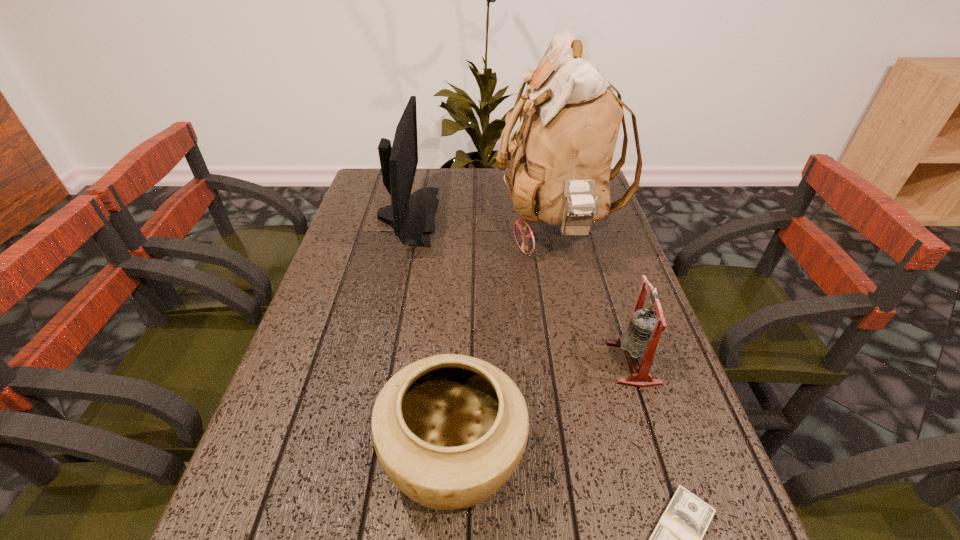
Locate an element on the screen. The width and height of the screenshot is (960, 540). free space located 0.320m on the right of the second shortest object is located at coordinates (710, 457).

Find the location of a particular element. This screenshot has width=960, height=540. backpack that is at the far edge is located at coordinates (560, 157).

You are a GUI agent. You are given a task and a screenshot of the screen. Output one action in this format:
    pyautogui.click(x=<x>, y=<y>)
    Task: Click on the monitor at the far edge
    The image size is (960, 540).
    Given the screenshot: What is the action you would take?
    pyautogui.click(x=411, y=215)

This screenshot has height=540, width=960. Identify the location of object that is positioned at the left edge. (411, 215).

This screenshot has height=540, width=960. What are the coordinates of `backpack positioned at the right edge` in the screenshot? It's located at (560, 157).

Where is `bell positioned at the right edge`? bell positioned at the right edge is located at coordinates (641, 339).

Locate an element on the screen. The width and height of the screenshot is (960, 540). object that is at the far left corner is located at coordinates (411, 215).

I want to click on object at the far right corner, so click(560, 157).

Locate an element on the screen. The height and width of the screenshot is (540, 960). free location at the far edge of the desktop is located at coordinates (484, 179).

The image size is (960, 540). In order to click on vacant space at the left edge of the desktop in this screenshot , I will do `click(359, 240)`.